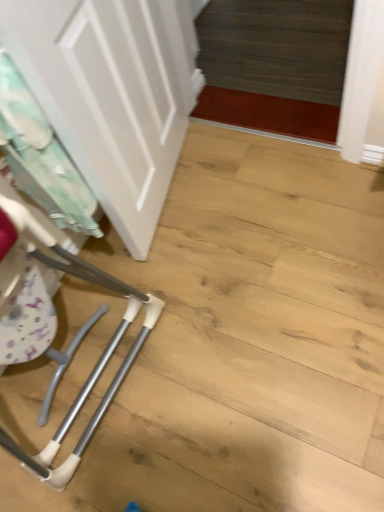
What do you see at coordinates (113, 94) in the screenshot? This screenshot has height=512, width=384. I see `white matte door at upper left` at bounding box center [113, 94].

Find the location of `white matte door at upper left`. white matte door at upper left is located at coordinates (113, 94).

Measure the distance between white fabric laundry at left and camera.

They are 32.19 inches apart.

You are a GUI agent. You are given a task and a screenshot of the screen. Output one action in this format:
    pyautogui.click(x=<x>, y=<y>)
    Task: Click on the white fabric laundry at left
    The image size is (384, 512).
    Given the screenshot: What is the action you would take?
    pyautogui.click(x=41, y=156)

In order to face white fabric laundry at left, should I rotate leftwards or rightwards?

Rotate left and turn 18.606 degrees.

This screenshot has width=384, height=512. Describe the element at coordinates (41, 156) in the screenshot. I see `white fabric laundry at left` at that location.

Locate an element on the screen. Image resolution: width=384 pixels, height=512 pixels. white matte door at upper left is located at coordinates (113, 94).

Between white fabric laundry at left and white matte door at upper left, which one appears on the right side from the viewer's perspective?

white matte door at upper left is more to the right.

Is white fabric laundry at left in front of white matte door at upper left?

No, white fabric laundry at left is further to the viewer.

Is point (70, 173) less distant than point (16, 56)?

That is False.

From the image's perspective, which is below, white fabric laundry at left or white matte door at upper left?

white fabric laundry at left.

From a real-world perspective, who is located higher, white fabric laundry at left or white matte door at upper left?

white matte door at upper left is physically above.

Is white fabric laundry at left wider than white matte door at upper left?

No, white fabric laundry at left is not wider than white matte door at upper left.

Consider the image. In terms of height, does white fabric laundry at left look taller or shorter compared to white matte door at upper left?

In the image, white fabric laundry at left appears to be shorter than white matte door at upper left.

In terms of size, does white fabric laundry at left appear bigger or smaller than white matte door at upper left?

Clearly, white fabric laundry at left is smaller in size than white matte door at upper left.

Would you say white fabric laundry at left contains white matte door at upper left?

No, white matte door at upper left is not surrounded by white fabric laundry at left.

Is white fabric laundry at left not near white matte door at upper left?

No, white fabric laundry at left is not far from white matte door at upper left.

Is white fabric laundry at left facing away from white matte door at upper left?

Yes, white fabric laundry at left is positioned with its back facing white matte door at upper left.

How much distance is there between white fabric laundry at left and white matte door at upper left?

A distance of 9.02 inches exists between white fabric laundry at left and white matte door at upper left.

The height and width of the screenshot is (512, 384). I want to click on laundry below the white matte door at upper left (from the image's perspective), so click(x=41, y=156).

Is white matte door at upper left to the left of white fabric laundry at left from the viewer's perspective?

No, white matte door at upper left is not to the left of white fabric laundry at left.

Considering their positions, is white matte door at upper left located in front of or behind white fabric laundry at left?

In the image, white matte door at upper left appears in front of white fabric laundry at left.

Considering the points (71, 127) and (35, 192), which point is in front, point (71, 127) or point (35, 192)?

Positioned in front is point (71, 127).

From the image's perspective, is white matte door at upper left above or below white fabric laundry at left?

white matte door at upper left is above white fabric laundry at left.

From a real-world perspective, which is physically below, white matte door at upper left or white fabric laundry at left?

In real-world perspective, white fabric laundry at left is lower.

Is white matte door at upper left wider than white fabric laundry at left?

Yes.

Does white matte door at upper left have a lesser height compared to white fabric laundry at left?

In fact, white matte door at upper left may be taller than white fabric laundry at left.

Is white matte door at upper left bigger or smaller than white fabric laundry at left?

Clearly, white matte door at upper left is larger in size than white fabric laundry at left.

Is white matte door at upper left surrounding white fabric laundry at left?

Yes, white fabric laundry at left is surrounded by white matte door at upper left.

Is white matte door at upper left with white fabric laundry at left?

white matte door at upper left is not next to white fabric laundry at left, and they're not touching.

Is white matte door at upper left looking in the opposite direction of white fabric laundry at left?

Yes, white fabric laundry at left is at the back of white matte door at upper left.

Can you tell me how much white matte door at upper left and white fabric laundry at left differ in facing direction?

4.87 degrees separate the facing orientations of white matte door at upper left and white fabric laundry at left.

Measure the distance from white matte door at upper left to white fabric laundry at left.

white matte door at upper left is 9.02 inches from white fabric laundry at left.

You are a GUI agent. You are given a task and a screenshot of the screen. Output one action in this format:
    pyautogui.click(x=<x>, y=<y>)
    Task: Click on the laundry below the white matte door at upper left (from the image's perspective)
    
    Given the screenshot: What is the action you would take?
    pyautogui.click(x=41, y=156)

You are a GUI agent. You are given a task and a screenshot of the screen. Output one action in this format:
    pyautogui.click(x=<x>, y=<y>)
    Task: Click on the door above the white fabric laundry at left (from the image's perspective)
    The height and width of the screenshot is (512, 384).
    Given the screenshot: What is the action you would take?
    pyautogui.click(x=113, y=94)

The image size is (384, 512). Identify the location of laundry on the left side of white matte door at upper left. (41, 156).